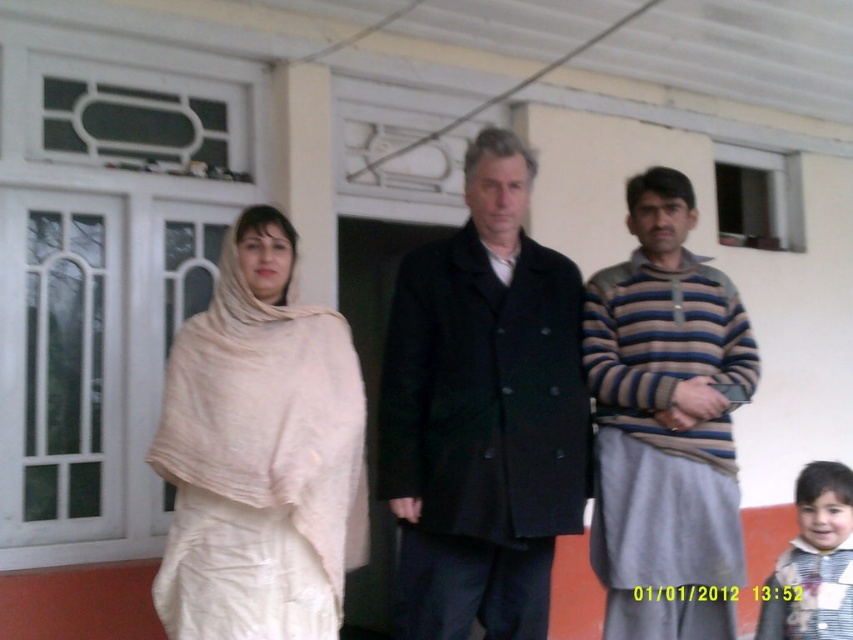
Question: Is beige fabric shawl at left bigger than striped sweater at center?

Choices:
 (A) yes
 (B) no

Answer: (A)

Question: Which object appears farthest from the camera in this image?

Choices:
 (A) black woolen coat at center
 (B) striped sweater at center

Answer: (B)

Question: Which is farther from the striped sweater at center?

Choices:
 (A) striped fabric shirt at lower right
 (B) light beige fabric at left
 (C) black woolen coat at center
 (D) beige fabric shawl at left

Answer: (D)

Question: Among these objects, which one is farthest from the camera?

Choices:
 (A) light beige fabric at left
 (B) striped fabric shirt at lower right
 (C) striped sweater at center
 (D) beige fabric shawl at left

Answer: (C)

Question: Observing the image, what is the correct spatial positioning of light beige fabric at left in reference to beige fabric shawl at left?

Choices:
 (A) right
 (B) left

Answer: (A)

Question: Can you confirm if beige fabric shawl at left is positioned above striped fabric shirt at lower right?

Choices:
 (A) no
 (B) yes

Answer: (B)